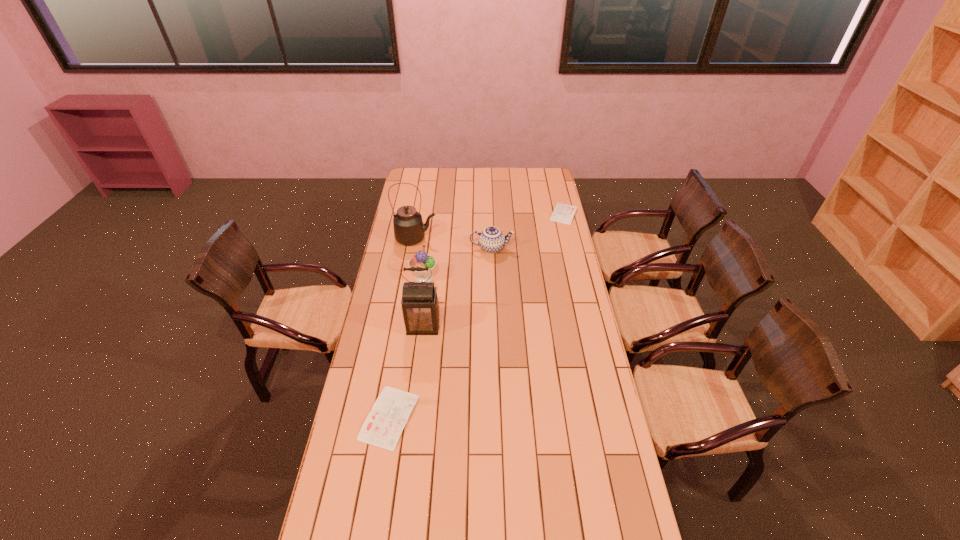
This screenshot has width=960, height=540. In order to click on object that is at the right edge in this screenshot , I will do `click(563, 213)`.

Find the location of `free location at the far edge of the desktop`. free location at the far edge of the desktop is located at coordinates (500, 175).

Where is `free point at the near edge`? free point at the near edge is located at coordinates click(563, 522).

Where is `vacant space at the left edge`? This screenshot has width=960, height=540. vacant space at the left edge is located at coordinates (348, 451).

Locate an element on the screen. The height and width of the screenshot is (540, 960). free space at the right edge of the desktop is located at coordinates (542, 253).

In the image, there is a desktop. What are the coordinates of `vacant space at the far left corner` in the screenshot? It's located at (422, 167).

This screenshot has height=540, width=960. Find the location of `free point at the far right corner`. free point at the far right corner is located at coordinates (543, 180).

You are a GUI agent. You are given a task and a screenshot of the screen. Output one action in this format:
    pyautogui.click(x=<x>, y=<y>)
    Task: Click on the vacant space in between the fifth tallest object and the fourth shortest object
    The height and width of the screenshot is (540, 960).
    Given the screenshot: What is the action you would take?
    pyautogui.click(x=407, y=347)

Where is `vacant region between the kettle and the fourth tallest object`? Image resolution: width=960 pixels, height=540 pixels. vacant region between the kettle and the fourth tallest object is located at coordinates (454, 244).

At what (x,y) coordinates should I click in order to perform the action: click on free space between the taller diary and the fifth farthest object. Please return your answer as a coordinate pair (x, y). The height and width of the screenshot is (540, 960). Looking at the image, I should click on (406, 372).